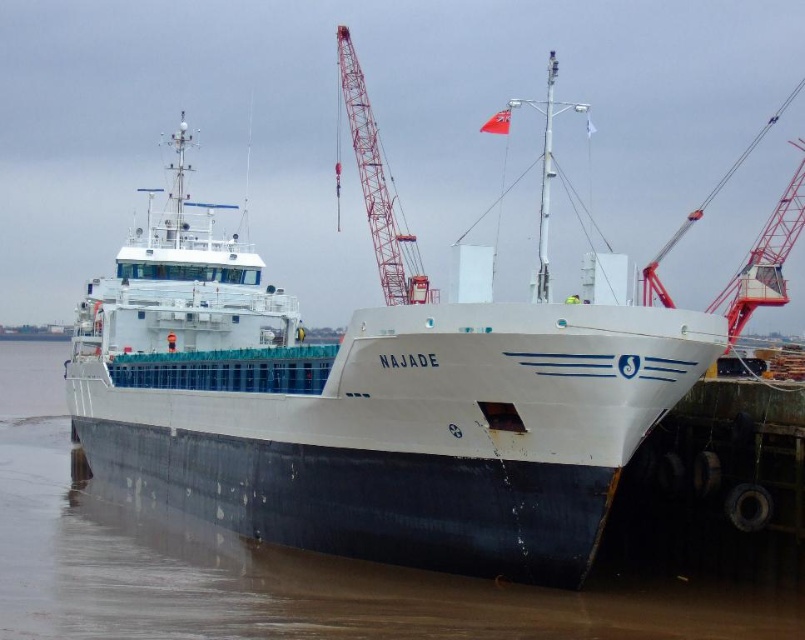
Question: Is metallic red crane at upper right bigger than red metal crane at upper right?

Choices:
 (A) yes
 (B) no

Answer: (A)

Question: Is white matte water at center above red metallic crane at upper center?

Choices:
 (A) yes
 (B) no

Answer: (B)

Question: Which of the following is the closest to the observer?

Choices:
 (A) white matte water at center
 (B) red metal crane at upper right

Answer: (A)

Question: Which point is farther from the camera taking this photo?

Choices:
 (A) (779, 220)
 (B) (739, 586)
 (C) (512, 467)

Answer: (A)

Question: Which object is positioned farthest from the metallic red crane at upper right?

Choices:
 (A) red metal crane at upper right
 (B) red metallic crane at upper center
 (C) white matte ship at center

Answer: (B)

Question: Does white matte water at center appear over red metallic crane at upper center?

Choices:
 (A) yes
 (B) no

Answer: (B)